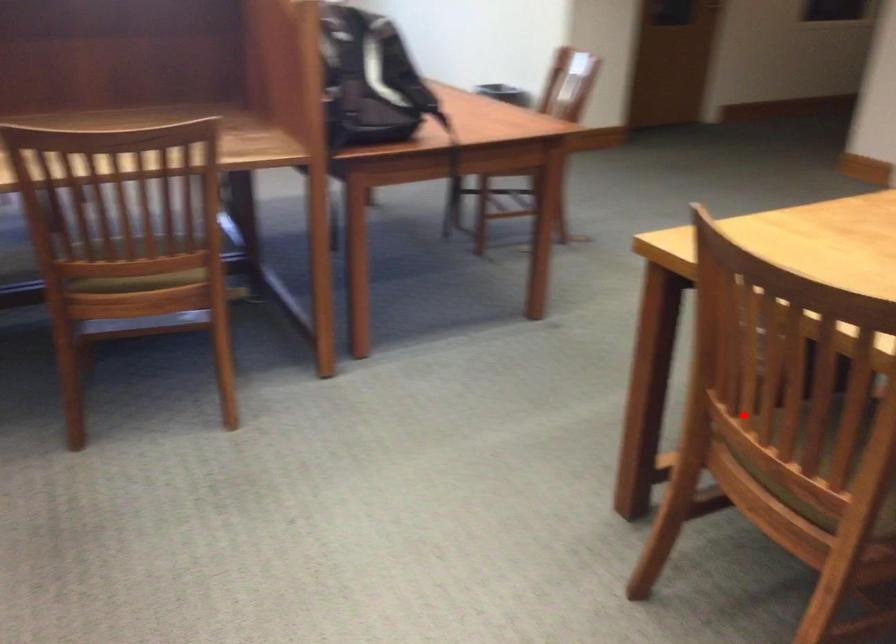
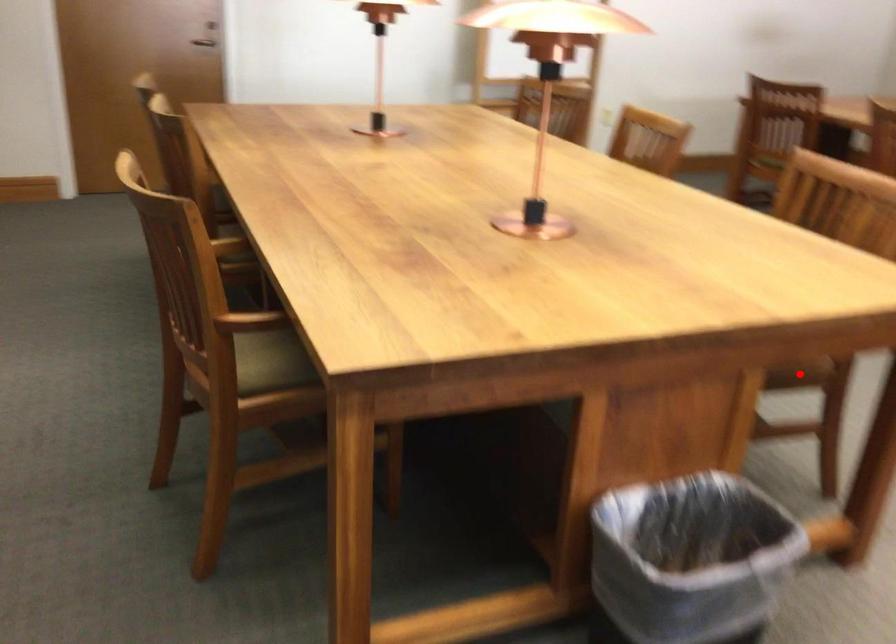
I am providing you with two images of the same scene from different viewpoints. A red point is marked on the first image and another point is marked on the second image. Is the red point in image1 aligned with the point shown in image2?

Yes